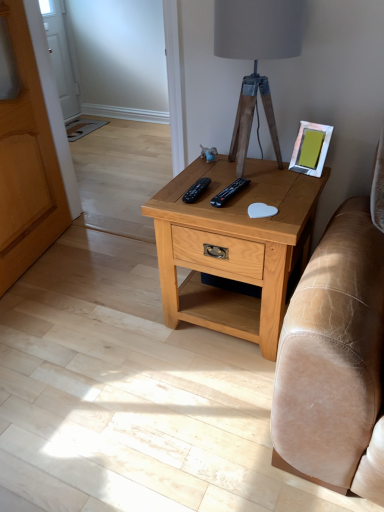
Image resolution: width=384 pixels, height=512 pixels. I want to click on free space to the left of black plastic remote at center, which is the 1th remote in right-to-left order, so click(193, 194).